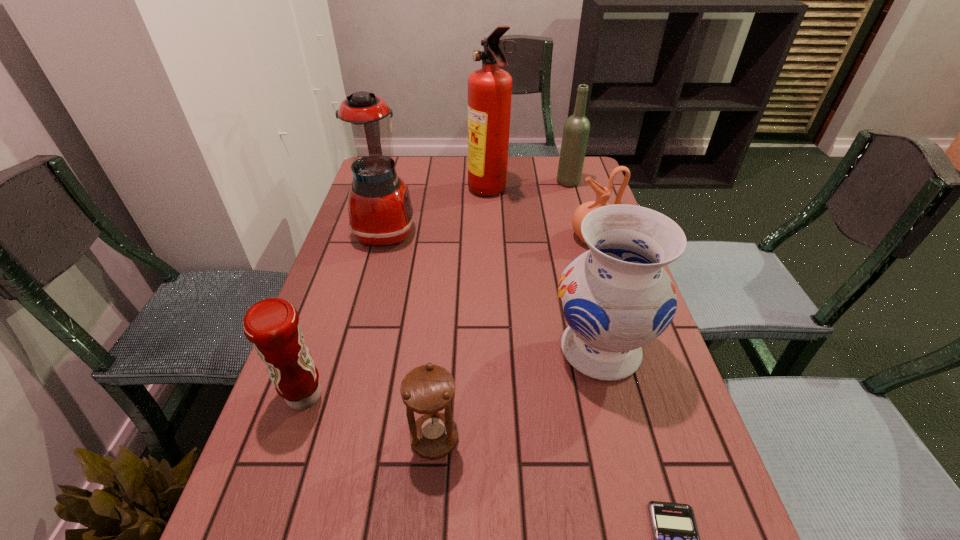
Find the location of a particular element. free region that satisfies the following two spatial constraints: 1. on the front side of the wine bottle; 2. on the controls of the second tallest object is located at coordinates (583, 231).

This screenshot has width=960, height=540. In order to click on free location that satisfies the following two spatial constraints: 1. on the controls of the second tallest object; 2. on the right side of the hourglass in this screenshot , I will do `click(329, 438)`.

This screenshot has width=960, height=540. What are the coordinates of `free space that satisfies the following two spatial constraints: 1. on the front-facing side of the fire extinguisher; 2. on the back side of the vase` in the screenshot? It's located at (493, 350).